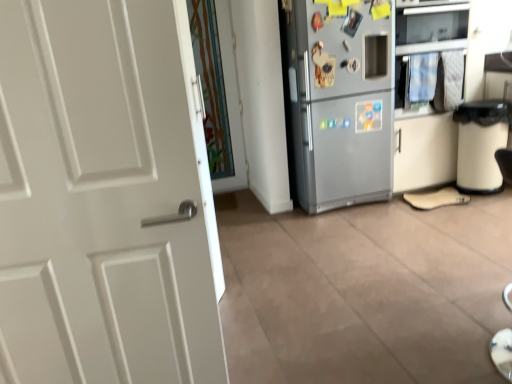
The width and height of the screenshot is (512, 384). What do you see at coordinates (341, 103) in the screenshot?
I see `satin silver refrigerator at center` at bounding box center [341, 103].

What do you see at coordinates (481, 144) in the screenshot? The width and height of the screenshot is (512, 384). I see `white plastic trash bin at right` at bounding box center [481, 144].

What is the approximate height of beige suede shoe at lower right?

1.27 inches.

Image resolution: width=512 pixels, height=384 pixels. I want to click on transparent glass door at center, so click(x=211, y=86).

Locate an element on the screen. The width and height of the screenshot is (512, 384). satin silver refrigerator at center is located at coordinates (341, 103).

In terms of size, does satin silver oven at upper right appear bigger or smaller than beige suede shoe at lower right?

Clearly, satin silver oven at upper right is larger in size than beige suede shoe at lower right.

Who is more distant, satin silver oven at upper right or beige suede shoe at lower right?

Positioned behind is beige suede shoe at lower right.

Image resolution: width=512 pixels, height=384 pixels. What are the coordinates of `shoe below the satin silver oven at upper right (from the image's perspective)` in the screenshot? It's located at (436, 198).

Considering the sizes of objects satin silver oven at upper right and beige suede shoe at lower right in the image provided, who is thinner, satin silver oven at upper right or beige suede shoe at lower right?

Thinner between the two is beige suede shoe at lower right.

Could you tell me if beige suede shoe at lower right is facing satin silver oven at upper right?

No.

Considering the relative positions of beige suede shoe at lower right and satin silver oven at upper right in the image provided, is beige suede shoe at lower right in front of satin silver oven at upper right?

No, beige suede shoe at lower right is behind satin silver oven at upper right.

Considering the relative sizes of beige suede shoe at lower right and satin silver oven at upper right in the image provided, is beige suede shoe at lower right bigger than satin silver oven at upper right?

No, beige suede shoe at lower right is not bigger than satin silver oven at upper right.

From a real-world perspective, is satin silver oven at upper right over transparent glass door at center?

Yes, from a real-world perspective, satin silver oven at upper right is on top of transparent glass door at center.

Which is behind, satin silver oven at upper right or transparent glass door at center?

transparent glass door at center.

Which object is wider, satin silver oven at upper right or transparent glass door at center?

satin silver oven at upper right is wider.

Which is more to the right, satin silver oven at upper right or transparent glass door at center?

satin silver oven at upper right.

Where is `refrigerator lying in front of the white plastic trash bin at right`? The image size is (512, 384). refrigerator lying in front of the white plastic trash bin at right is located at coordinates (341, 103).

Considering the sizes of objects white plastic trash bin at right and satin silver refrigerator at center in the image provided, who is bigger, white plastic trash bin at right or satin silver refrigerator at center?

satin silver refrigerator at center.

Relative to satin silver refrigerator at center, is white plastic trash bin at right in front or behind?

white plastic trash bin at right is positioned farther from the viewer than satin silver refrigerator at center.

In the scene shown: Considering the relative positions of transparent glass door at center and satin silver refrigerator at center in the image provided, is transparent glass door at center behind satin silver refrigerator at center?

Yes, transparent glass door at center is further from the camera.

Is transparent glass door at center positioned beyond the bounds of satin silver refrigerator at center?

Indeed, transparent glass door at center is completely outside satin silver refrigerator at center.

Is point (197, 4) positioned in front of point (357, 3)?

Yes, point (197, 4) is in front of point (357, 3).

Is transparent glass door at center turned away from satin silver refrigerator at center?

No, transparent glass door at center's orientation is not away from satin silver refrigerator at center.

Which of these two, satin silver refrigerator at center or satin silver oven at upper right, stands shorter?

With less height is satin silver oven at upper right.

Is satin silver refrigerator at center aimed at satin silver oven at upper right?

No, satin silver refrigerator at center is not facing towards satin silver oven at upper right.

Which object is thinner, satin silver refrigerator at center or satin silver oven at upper right?

Thinner between the two is satin silver refrigerator at center.

From a real-world perspective, is satin silver refrigerator at center beneath satin silver oven at upper right?

Yes, from a real-world perspective, satin silver refrigerator at center is under satin silver oven at upper right.

Which of these two, satin silver oven at upper right or white plastic trash bin at right, is wider?

satin silver oven at upper right.

From the image's perspective, does satin silver oven at upper right appear higher than white plastic trash bin at right?

Yes.

Are satin silver oven at upper right and white plastic trash bin at right making contact?

They are not placed beside each other.

I want to click on oven in front of the beige suede shoe at lower right, so click(x=433, y=55).

Image resolution: width=512 pixels, height=384 pixels. I want to click on oven above the beige suede shoe at lower right (from the image's perspective), so click(x=433, y=55).

Considering their positions, is beige suede shoe at lower right positioned closer to white plastic trash bin at right than satin silver refrigerator at center?

beige suede shoe at lower right lies closer to white plastic trash bin at right than the other object.

Looking at the image, which one is located further to white plastic trash bin at right, transparent glass door at center or satin silver refrigerator at center?

transparent glass door at center.

Which object lies nearer to the anchor point beige suede shoe at lower right, satin silver oven at upper right or satin silver refrigerator at center?

satin silver refrigerator at center is closer to beige suede shoe at lower right.

When comparing their distances from white plastic trash bin at right, does beige suede shoe at lower right or transparent glass door at center seem further?

transparent glass door at center.

Estimate the real-world distances between objects in this image. Which object is further from transparent glass door at center, beige suede shoe at lower right or satin silver refrigerator at center?

The object further to transparent glass door at center is beige suede shoe at lower right.

Based on their spatial positions, is transparent glass door at center or beige suede shoe at lower right closer to satin silver refrigerator at center?

beige suede shoe at lower right is closer to satin silver refrigerator at center.

Considering their positions, is white plastic trash bin at right positioned closer to beige suede shoe at lower right than satin silver refrigerator at center?

white plastic trash bin at right lies closer to beige suede shoe at lower right than the other object.

From the image, which object appears to be farther from satin silver oven at upper right, satin silver refrigerator at center or beige suede shoe at lower right?

beige suede shoe at lower right is positioned further to the anchor satin silver oven at upper right.

Identify the location of refrigerator located between transparent glass door at center and white plastic trash bin at right in the left-right direction. (341, 103).

Find the location of a particular element. Image resolution: width=512 pixels, height=384 pixels. oven situated between transparent glass door at center and beige suede shoe at lower right from left to right is located at coordinates (433, 55).

Find the location of `refrigerator between satin silver oven at upper right and beige suede shoe at lower right from top to bottom`. refrigerator between satin silver oven at upper right and beige suede shoe at lower right from top to bottom is located at coordinates (341, 103).

Find the location of a particular element. This screenshot has width=512, height=384. shoe between satin silver refrigerator at center and white plastic trash bin at right in the horizontal direction is located at coordinates tap(436, 198).